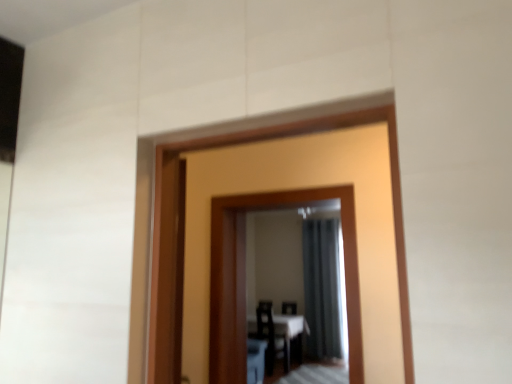
Question: Does dark gray fabric curtain at center have a greater height compared to wooden mirror at center?

Choices:
 (A) yes
 (B) no

Answer: (A)

Question: Is wooden mirror at center at the back of dark gray fabric curtain at center?

Choices:
 (A) no
 (B) yes

Answer: (A)

Question: Does dark gray fabric curtain at center come in front of wooden mirror at center?

Choices:
 (A) no
 (B) yes

Answer: (A)

Question: Does dark gray fabric curtain at center appear on the right side of wooden mirror at center?

Choices:
 (A) no
 (B) yes

Answer: (B)

Question: From a real-world perspective, is dark gray fabric curtain at center located higher than wooden mirror at center?

Choices:
 (A) no
 (B) yes

Answer: (A)

Question: Does dark gray fabric curtain at center have a lesser height compared to wooden mirror at center?

Choices:
 (A) yes
 (B) no

Answer: (B)

Question: Is black plastic chair at center next to wooden mirror at center?

Choices:
 (A) yes
 (B) no

Answer: (B)

Question: Does black plastic chair at center have a lesser height compared to wooden mirror at center?

Choices:
 (A) no
 (B) yes

Answer: (B)

Question: Does black plastic chair at center have a greater width compared to wooden mirror at center?

Choices:
 (A) no
 (B) yes

Answer: (A)

Question: From a real-world perspective, is black plastic chair at center physically above wooden mirror at center?

Choices:
 (A) no
 (B) yes

Answer: (A)

Question: From a real-world perspective, is black plastic chair at center under wooden mirror at center?

Choices:
 (A) yes
 (B) no

Answer: (A)

Question: Does black plastic chair at center have a larger size compared to wooden mirror at center?

Choices:
 (A) no
 (B) yes

Answer: (A)

Question: Can you confirm if dark gray fabric curtain at center is wider than black plastic chair at center?

Choices:
 (A) yes
 (B) no

Answer: (A)